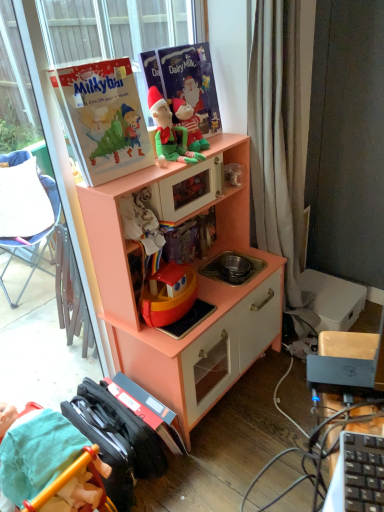
Question: Considering the relative positions of green plush toy at upper center, which is counted as the second person, starting from the left, and smooth teal fabric at lower left, the 2th person viewed from the right, in the image provided, is green plush toy at upper center, which is counted as the second person, starting from the left, to the left or to the right of smooth teal fabric at lower left, the 2th person viewed from the right,?

Choices:
 (A) right
 (B) left

Answer: (A)

Question: Based on their sizes in the image, would you say green plush toy at upper center, which is counted as the second person, starting from the left, is bigger or smaller than smooth teal fabric at lower left, the 2th person in the top-to-bottom sequence?

Choices:
 (A) small
 (B) big

Answer: (A)

Question: Which is farther from the matte paper book at upper center, which is the second paperback book in left-to-right order?

Choices:
 (A) matte paperboard book at upper left, arranged as the 1th paperback book when viewed from the left
 (B) peach wood toy kitchen at center
 (C) green plush toy at upper center, marked as the 1th person in a right-to-left arrangement
 (D) smooth teal fabric at lower left, which appears as the 1th person when ordered from the bottom

Answer: (D)

Question: Which object is positioned closest to the matte paperboard book at upper left, arranged as the 1th paperback book when viewed from the left?

Choices:
 (A) matte paper book at upper center, which is the second paperback book in left-to-right order
 (B) peach wood toy kitchen at center
 (C) green plush toy at upper center, which is counted as the second person, starting from the left
 (D) smooth teal fabric at lower left, positioned as the first person in left-to-right order

Answer: (C)